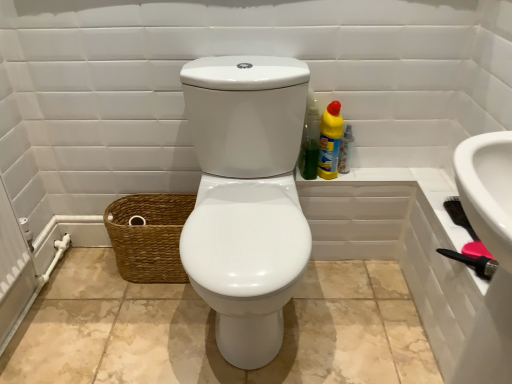
Measure the distance between translucent plastic spray bottle at right and camera.

translucent plastic spray bottle at right is 1.47 meters from camera.

What do you see at coordinates (330, 141) in the screenshot? The image size is (512, 384). I see `yellow plastic bottle at upper right, acting as the second cleaning product starting from the left` at bounding box center [330, 141].

The image size is (512, 384). Identify the location of green plastic bottle at upper right, placed as the first cleaning product when sorted from left to right. (310, 141).

Where is `bottle that is under the green plastic bottle at upper right, positioned as the second cleaning product in right-to-left order (from a real-world perspective)`? bottle that is under the green plastic bottle at upper right, positioned as the second cleaning product in right-to-left order (from a real-world perspective) is located at coordinates (345, 150).

Is translucent plastic spray bottle at right looking in the opposite direction of green plastic bottle at upper right, positioned as the second cleaning product in right-to-left order?

No, translucent plastic spray bottle at right's orientation is not away from green plastic bottle at upper right, positioned as the second cleaning product in right-to-left order.

Looking at their sizes, would you say translucent plastic spray bottle at right is wider or thinner than green plastic bottle at upper right, placed as the first cleaning product when sorted from left to right?

Clearly, translucent plastic spray bottle at right has less width compared to green plastic bottle at upper right, placed as the first cleaning product when sorted from left to right.

Considering the positions of objects translucent plastic spray bottle at right and green plastic bottle at upper right, placed as the first cleaning product when sorted from left to right, in the image provided, who is more to the left, translucent plastic spray bottle at right or green plastic bottle at upper right, placed as the first cleaning product when sorted from left to right,?

From the viewer's perspective, green plastic bottle at upper right, placed as the first cleaning product when sorted from left to right, appears more on the left side.

Would you say brown woven basket at lower left is to the left or to the right of green plastic bottle at upper right, positioned as the second cleaning product in right-to-left order, in the picture?

Based on their positions, brown woven basket at lower left is located to the left of green plastic bottle at upper right, positioned as the second cleaning product in right-to-left order.

How many degrees apart are the facing directions of brown woven basket at lower left and green plastic bottle at upper right, positioned as the second cleaning product in right-to-left order?

The facing directions of brown woven basket at lower left and green plastic bottle at upper right, positioned as the second cleaning product in right-to-left order, are 0.00118 degrees apart.

Is brown woven basket at lower left not near green plastic bottle at upper right, placed as the first cleaning product when sorted from left to right?

No.

Is brown woven basket at lower left looking in the opposite direction of green plastic bottle at upper right, placed as the first cleaning product when sorted from left to right?

No, brown woven basket at lower left is not facing the opposite direction of green plastic bottle at upper right, placed as the first cleaning product when sorted from left to right.

Considering the positions of point (343, 139) and point (317, 172), is point (343, 139) closer or farther from the camera than point (317, 172)?

Point (343, 139) appears to be closer to the viewer than point (317, 172).

Between translucent plastic spray bottle at right and yellow plastic bottle at upper right, which ranks as the first cleaning product in right-to-left order, which one has larger size?

yellow plastic bottle at upper right, which ranks as the first cleaning product in right-to-left order.

From the image's perspective, relative to yellow plastic bottle at upper right, acting as the second cleaning product starting from the left, is translucent plastic spray bottle at right above or below?

Clearly, from the image's perspective, translucent plastic spray bottle at right is below yellow plastic bottle at upper right, acting as the second cleaning product starting from the left.

The height and width of the screenshot is (384, 512). Identify the location of cleaning product that is the 1st object above the translucent plastic spray bottle at right (from a real-world perspective). (330, 141).

Which object is wider, brown woven basket at lower left or translucent plastic spray bottle at right?

Wider between the two is brown woven basket at lower left.

Is brown woven basket at lower left taller than translucent plastic spray bottle at right?

Correct, brown woven basket at lower left is much taller as translucent plastic spray bottle at right.

Would you say brown woven basket at lower left is outside translucent plastic spray bottle at right?

Yes, brown woven basket at lower left is outside of translucent plastic spray bottle at right.

At what (x,y) coordinates should I click in order to perform the action: click on bottle lying below the yellow plastic bottle at upper right, acting as the second cleaning product starting from the left (from the image's perspective). Please return your answer as a coordinate pair (x, y). This screenshot has height=384, width=512. Looking at the image, I should click on pos(345,150).

From a real-world perspective, between yellow plastic bottle at upper right, which ranks as the first cleaning product in right-to-left order, and translucent plastic spray bottle at right, who is vertically lower?

translucent plastic spray bottle at right, from a real-world perspective.

From the image's perspective, which is below, yellow plastic bottle at upper right, which ranks as the first cleaning product in right-to-left order, or translucent plastic spray bottle at right?

From the image's view, translucent plastic spray bottle at right is below.

Can you tell me how much green plastic bottle at upper right, placed as the first cleaning product when sorted from left to right, and yellow plastic bottle at upper right, acting as the second cleaning product starting from the left, differ in facing direction?

The angle between the facing direction of green plastic bottle at upper right, placed as the first cleaning product when sorted from left to right, and the facing direction of yellow plastic bottle at upper right, acting as the second cleaning product starting from the left, is 0.000496 degrees.

Relative to yellow plastic bottle at upper right, acting as the second cleaning product starting from the left, is green plastic bottle at upper right, placed as the first cleaning product when sorted from left to right, in front or behind?

green plastic bottle at upper right, placed as the first cleaning product when sorted from left to right, is positioned closer to the viewer than yellow plastic bottle at upper right, acting as the second cleaning product starting from the left.

You are a GUI agent. You are given a task and a screenshot of the screen. Output one action in this format:
    pyautogui.click(x=<x>, y=<y>)
    Task: Click on the cleaning product above the yellow plastic bottle at upper right, acting as the second cleaning product starting from the left (from a real-world perspective)
    
    Given the screenshot: What is the action you would take?
    pyautogui.click(x=310, y=141)

From a real-world perspective, between green plastic bottle at upper right, placed as the first cleaning product when sorted from left to right, and yellow plastic bottle at upper right, which ranks as the first cleaning product in right-to-left order, who is vertically higher?

In real-world perspective, green plastic bottle at upper right, placed as the first cleaning product when sorted from left to right, is above.

From a real-world perspective, is green plastic bottle at upper right, placed as the first cleaning product when sorted from left to right, on top of brown woven basket at lower left?

Yes, from a real-world perspective, green plastic bottle at upper right, placed as the first cleaning product when sorted from left to right, is on top of brown woven basket at lower left.

Considering the relative sizes of green plastic bottle at upper right, positioned as the second cleaning product in right-to-left order, and brown woven basket at lower left in the image provided, is green plastic bottle at upper right, positioned as the second cleaning product in right-to-left order, shorter than brown woven basket at lower left?

No.

Measure the distance from green plastic bottle at upper right, placed as the first cleaning product when sorted from left to right, to brown woven basket at lower left.

23.71 inches.

Can you tell me how much green plastic bottle at upper right, placed as the first cleaning product when sorted from left to right, and brown woven basket at lower left differ in facing direction?

green plastic bottle at upper right, placed as the first cleaning product when sorted from left to right, and brown woven basket at lower left are facing 0.00118 degrees away from each other.

Where is `the 2nd cleaning product counting from the left side of the translucent plastic spray bottle at right`? This screenshot has height=384, width=512. the 2nd cleaning product counting from the left side of the translucent plastic spray bottle at right is located at coordinates (310, 141).

This screenshot has width=512, height=384. I want to click on the 1st cleaning product counting from the right side of the brown woven basket at lower left, so click(310, 141).

Looking at the image, which one is located closer to brown woven basket at lower left, yellow plastic bottle at upper right, which ranks as the first cleaning product in right-to-left order, or green plastic bottle at upper right, placed as the first cleaning product when sorted from left to right?

Among the two, green plastic bottle at upper right, placed as the first cleaning product when sorted from left to right, is located nearer to brown woven basket at lower left.

When comparing their distances from translucent plastic spray bottle at right, does brown woven basket at lower left or green plastic bottle at upper right, positioned as the second cleaning product in right-to-left order, seem further?

The object further to translucent plastic spray bottle at right is brown woven basket at lower left.

Based on their spatial positions, is brown woven basket at lower left or green plastic bottle at upper right, positioned as the second cleaning product in right-to-left order, further from yellow plastic bottle at upper right, acting as the second cleaning product starting from the left?

The object further to yellow plastic bottle at upper right, acting as the second cleaning product starting from the left, is brown woven basket at lower left.

Estimate the real-world distances between objects in this image. Which object is further from yellow plastic bottle at upper right, which ranks as the first cleaning product in right-to-left order, brown woven basket at lower left or translucent plastic spray bottle at right?

brown woven basket at lower left lies further to yellow plastic bottle at upper right, which ranks as the first cleaning product in right-to-left order, than the other object.

Looking at the image, which one is located closer to translucent plastic spray bottle at right, brown woven basket at lower left or yellow plastic bottle at upper right, which ranks as the first cleaning product in right-to-left order?

The object closer to translucent plastic spray bottle at right is yellow plastic bottle at upper right, which ranks as the first cleaning product in right-to-left order.

From the picture: Considering their positions, is translucent plastic spray bottle at right positioned further to yellow plastic bottle at upper right, acting as the second cleaning product starting from the left, than brown woven basket at lower left?

The object further to yellow plastic bottle at upper right, acting as the second cleaning product starting from the left, is brown woven basket at lower left.

Based on their spatial positions, is green plastic bottle at upper right, placed as the first cleaning product when sorted from left to right, or brown woven basket at lower left closer to translucent plastic spray bottle at right?

Among the two, green plastic bottle at upper right, placed as the first cleaning product when sorted from left to right, is located nearer to translucent plastic spray bottle at right.

From the image, which object appears to be nearer to brown woven basket at lower left, yellow plastic bottle at upper right, acting as the second cleaning product starting from the left, or translucent plastic spray bottle at right?

yellow plastic bottle at upper right, acting as the second cleaning product starting from the left.

You are a GUI agent. You are given a task and a screenshot of the screen. Output one action in this format:
    pyautogui.click(x=<x>, y=<y>)
    Task: Click on the cleaning product between green plastic bottle at upper right, positioned as the second cleaning product in right-to-left order, and translucent plastic spray bottle at right
    Image resolution: width=512 pixels, height=384 pixels.
    Given the screenshot: What is the action you would take?
    pyautogui.click(x=330, y=141)

Where is `cleaning product between brown woven basket at lower left and yellow plastic bottle at upper right, acting as the second cleaning product starting from the left, from left to right`? cleaning product between brown woven basket at lower left and yellow plastic bottle at upper right, acting as the second cleaning product starting from the left, from left to right is located at coordinates (310, 141).